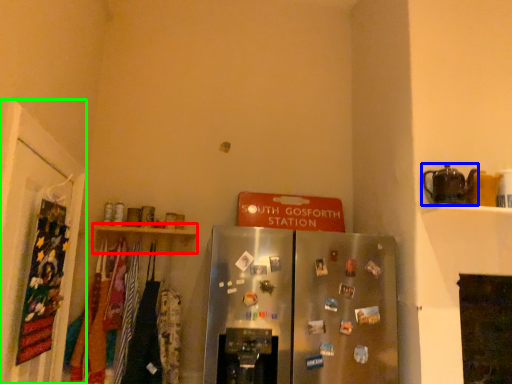
Question: Which is nearer to the shelf (highlighted by a red box)? appliance (highlighted by a blue box) or door (highlighted by a green box).

Choices:
 (A) appliance
 (B) door

Answer: (B)